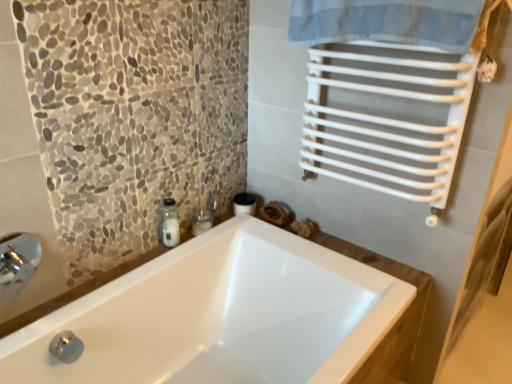
You are a GUI agent. You are given a task and a screenshot of the screen. Output one action in this format:
    pyautogui.click(x=<x>, y=<y>)
    Task: Click on the free space in front of clear glass jar at center
    
    Given the screenshot: What is the action you would take?
    pyautogui.click(x=189, y=254)